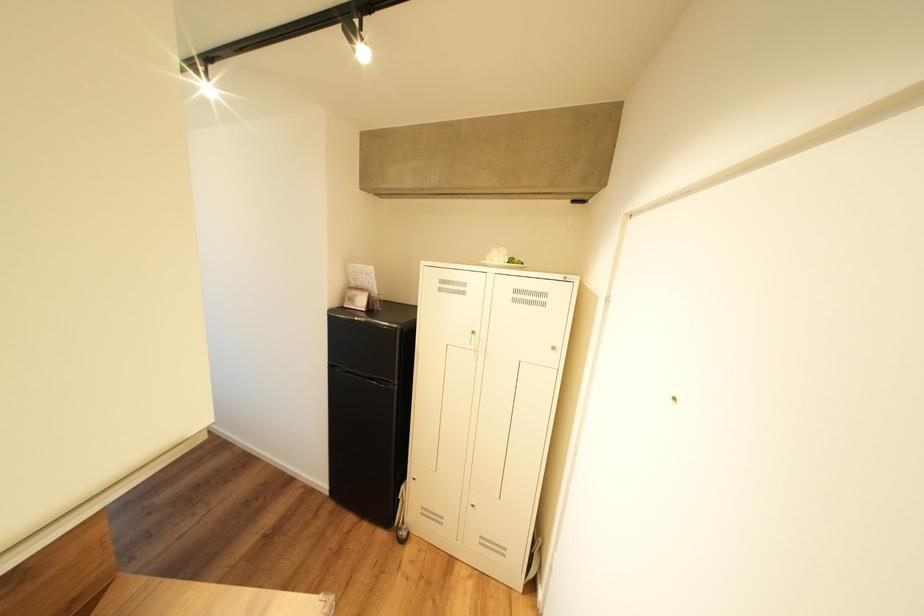
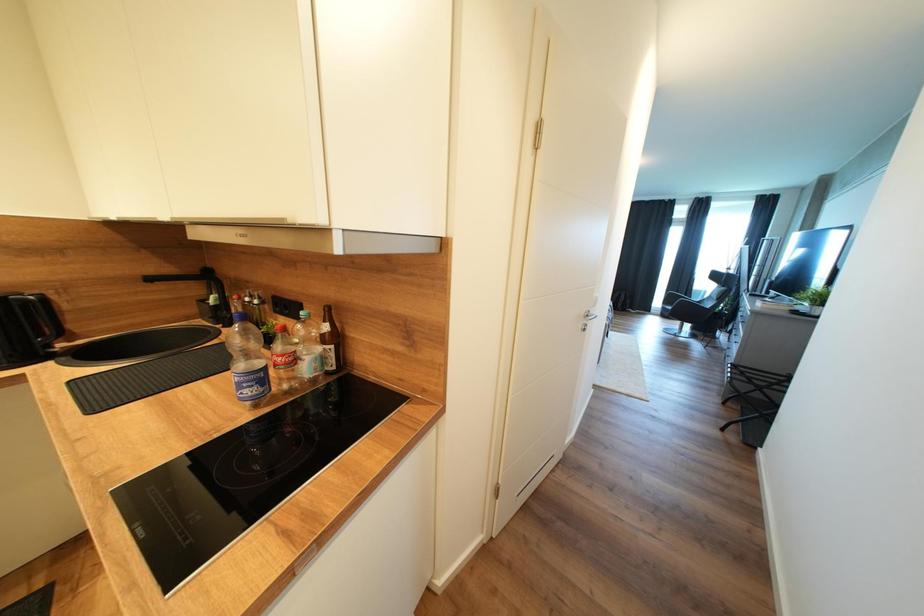
Question: The first image is from the beginning of the video and the second image is from the end. How did the camera likely rotate when shooting the video?

Choices:
 (A) Left
 (B) Right
 (C) Up
 (D) Down

Answer: (A)